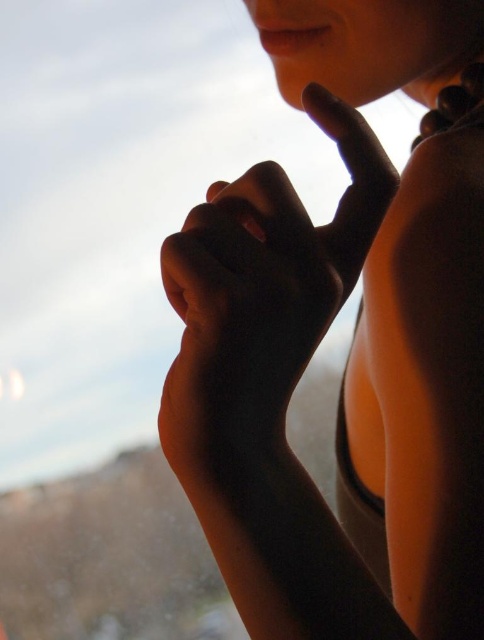
Question: Among these points, which one is nearest to the camera?

Choices:
 (A) (293, 273)
 (B) (463, 438)

Answer: (A)

Question: Is smooth skin at center below smooth skin hand at center?

Choices:
 (A) no
 (B) yes

Answer: (B)

Question: Is smooth skin at center to the right of smooth skin hand at center from the viewer's perspective?

Choices:
 (A) yes
 (B) no

Answer: (A)

Question: Which object appears farthest from the camera in this image?

Choices:
 (A) smooth skin hand at center
 (B) smooth skin at center

Answer: (A)

Question: Is smooth skin at center above smooth skin hand at center?

Choices:
 (A) no
 (B) yes

Answer: (A)